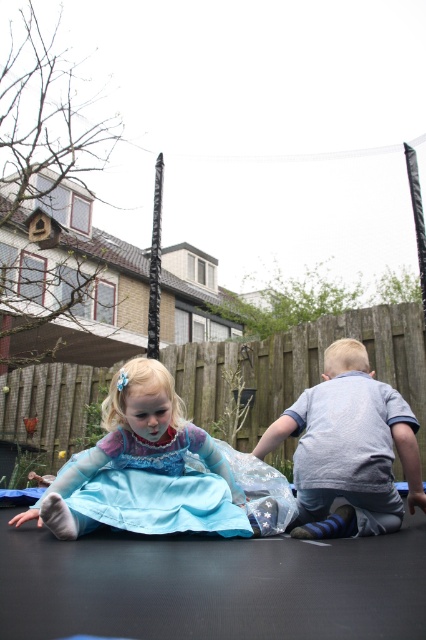
Question: Is the position of blue satin dress at center more distant than that of light blue cotton shirt at center?

Choices:
 (A) yes
 (B) no

Answer: (B)

Question: Can you confirm if blue satin dress at center is wider than light blue cotton shirt at center?

Choices:
 (A) yes
 (B) no

Answer: (A)

Question: Is blue satin dress at center to the left of light blue cotton shirt at center from the viewer's perspective?

Choices:
 (A) no
 (B) yes

Answer: (B)